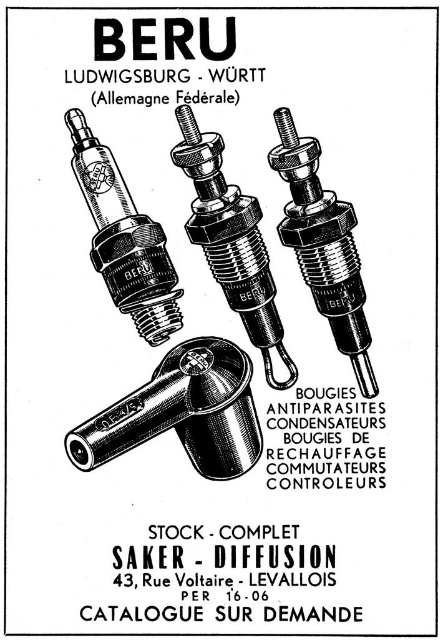
Question: Which point is farther to the camera?

Choices:
 (A) (174, 305)
 (B) (213, 179)
 (C) (162, 362)

Answer: (C)

Question: Can you confirm if metallic silver spark plug at center is bigger than polished metal spark plug at upper left?

Choices:
 (A) yes
 (B) no

Answer: (A)

Question: Estimate the real-world distances between objects in this image. Which object is closer to the metallic/smooth/valve at lower center?

Choices:
 (A) polished metal spark plug at upper left
 (B) metallic silver spark plug at center

Answer: (A)

Question: From the image, what is the correct spatial relationship of metallic/smooth/valve at lower center in relation to metallic silver spark plug at center?

Choices:
 (A) below
 (B) above

Answer: (A)

Question: Which of these objects is positioned farthest from the metallic/smooth/valve at lower center?

Choices:
 (A) matte silver spark plug at center
 (B) metallic silver spark plug at center

Answer: (B)

Question: Is metallic silver spark plug at center positioned at the back of matte silver spark plug at center?

Choices:
 (A) yes
 (B) no

Answer: (A)